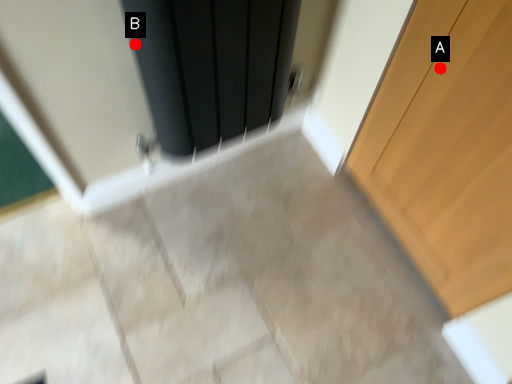
Question: Two points are circled on the image, labeled by A and B beside each circle. Which point is farther to the camera?

Choices:
 (A) A is further
 (B) B is further

Answer: (A)